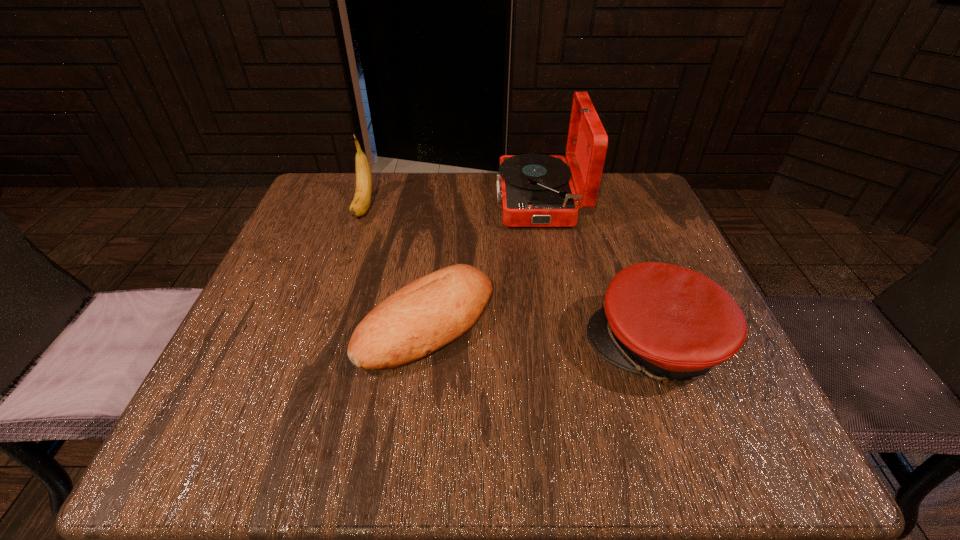
In order to click on free space located on the front of the second shortest object with an emblem in this screenshot , I will do `click(404, 346)`.

You are a GUI agent. You are given a task and a screenshot of the screen. Output one action in this format:
    pyautogui.click(x=<x>, y=<y>)
    Task: Click on the blank area located 0.220m on the front of the second shortest object with an emblem
    
    Given the screenshot: What is the action you would take?
    pyautogui.click(x=458, y=346)

Locate an element on the screen. blank area located on the front of the second shortest object with an emblem is located at coordinates (535, 346).

Where is `vacant space located on the left of the second object from left to right`? The width and height of the screenshot is (960, 540). vacant space located on the left of the second object from left to right is located at coordinates (288, 323).

I want to click on phonograph_record that is positioned at the far edge, so click(536, 190).

At what (x,y) coordinates should I click in order to perform the action: click on banana that is at the far edge. Please return your answer as a coordinate pair (x, y). The width and height of the screenshot is (960, 540). Looking at the image, I should click on (360, 204).

I want to click on object at the left edge, so click(x=360, y=204).

Find the location of a particular element. The image size is (960, 540). object at the right edge is located at coordinates (670, 323).

The image size is (960, 540). Find the location of `object at the far left corner`. object at the far left corner is located at coordinates (360, 204).

Where is `vacant position at the far edge of the desktop`? The image size is (960, 540). vacant position at the far edge of the desktop is located at coordinates (441, 194).